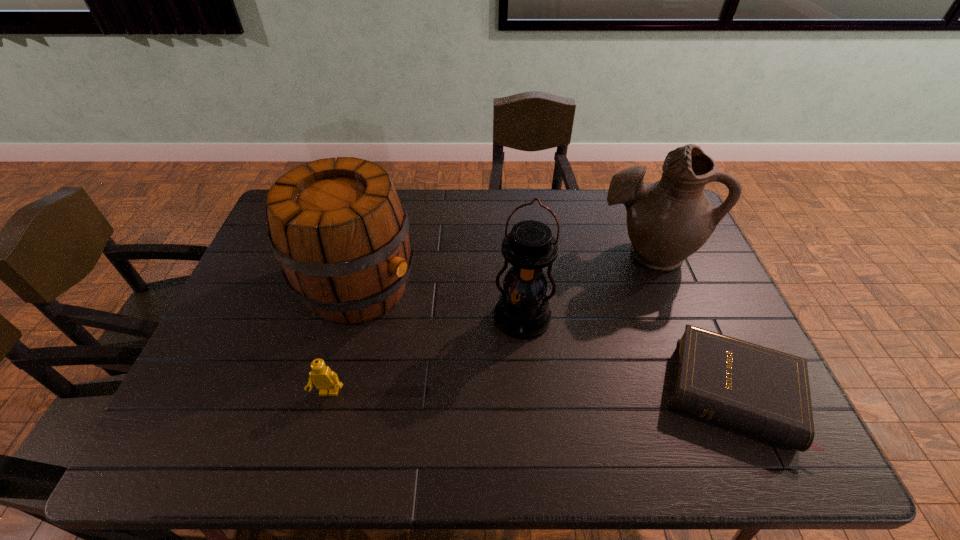
You are a GUI agent. You are given a task and a screenshot of the screen. Output one action in this format:
    pyautogui.click(x=<x>, y=<y>)
    Task: Click on the Lego
    This screenshot has height=540, width=960.
    Given the screenshot: What is the action you would take?
    pyautogui.click(x=324, y=379)

Image resolution: width=960 pixels, height=540 pixels. In order to click on Bible in this screenshot , I will do `click(764, 392)`.

Image resolution: width=960 pixels, height=540 pixels. I want to click on the third object from right to left, so click(523, 312).

Locate an element on the screen. Image resolution: width=960 pixels, height=540 pixels. pitcher is located at coordinates (667, 221).

You are a GUI agent. You are given a task and a screenshot of the screen. Output one action in this format:
    pyautogui.click(x=<x>, y=<y>)
    Task: Click on the cider
    This screenshot has width=960, height=540.
    Given the screenshot: What is the action you would take?
    pyautogui.click(x=338, y=228)

The height and width of the screenshot is (540, 960). I want to click on vacant space positioned on the left of the Bible, so click(x=604, y=393).

Give me the position of a free location located above the third object from right to left, indicating its light source. Please provide its 2D coordinates. Your answer should be formatted as a tuple, i.e. [(x, y)], where the tuple contains the x and y coordinates of a point satisfying the conditions above.

[(516, 359)]

Locate some placea in vacant space located 0.140m above the third object from right to left, indicating its light source. Please provide its 2D coordinates. Your answer should be formatted as a tuple, i.e. [(x, y)], where the tuple contains the x and y coordinates of a point satisfying the conditions above.

[(510, 390)]

Can you point to a free location located above the third object from right to left, indicating its light source? Please provide its 2D coordinates. Your answer should be formatted as a tuple, i.e. [(x, y)], where the tuple contains the x and y coordinates of a point satisfying the conditions above.

[(511, 383)]

Image resolution: width=960 pixels, height=540 pixels. Identify the location of free location located at the spout of the pitcher. (594, 307).